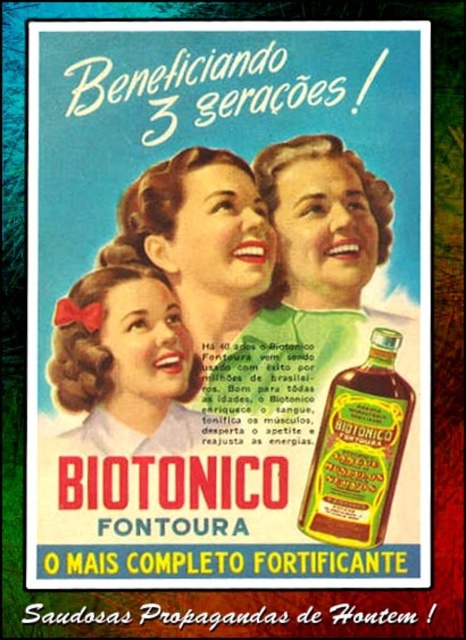
Question: Estimate the real-world distances between objects in this image. Which object is closer to the green glass bottle at center-right?

Choices:
 (A) matte white blouse at center
 (B) matte green dress at center

Answer: (B)

Question: Is matte green dress at center thinner than green glass bottle at center-right?

Choices:
 (A) yes
 (B) no

Answer: (B)

Question: In this image, where is matte green dress at center located relative to matte white blouse at center?

Choices:
 (A) above
 (B) below

Answer: (A)

Question: Which point is farther to the camera?

Choices:
 (A) matte green dress at center
 (B) green glass bottle at center-right

Answer: (A)

Question: Can you confirm if matte green dress at center is positioned to the right of green glass bottle at center-right?

Choices:
 (A) yes
 (B) no

Answer: (B)

Question: Among these points, which one is farthest from the camera?

Choices:
 (A) (379, 420)
 (B) (163, 243)

Answer: (B)